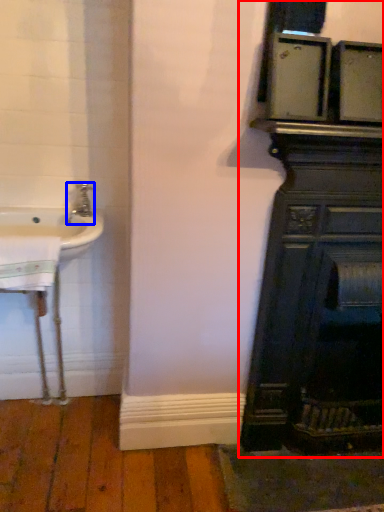
Question: Which point is further to the camera, bathroom cabinet (highlighted by a red box) or tap (highlighted by a blue box)?

Choices:
 (A) bathroom cabinet
 (B) tap

Answer: (B)